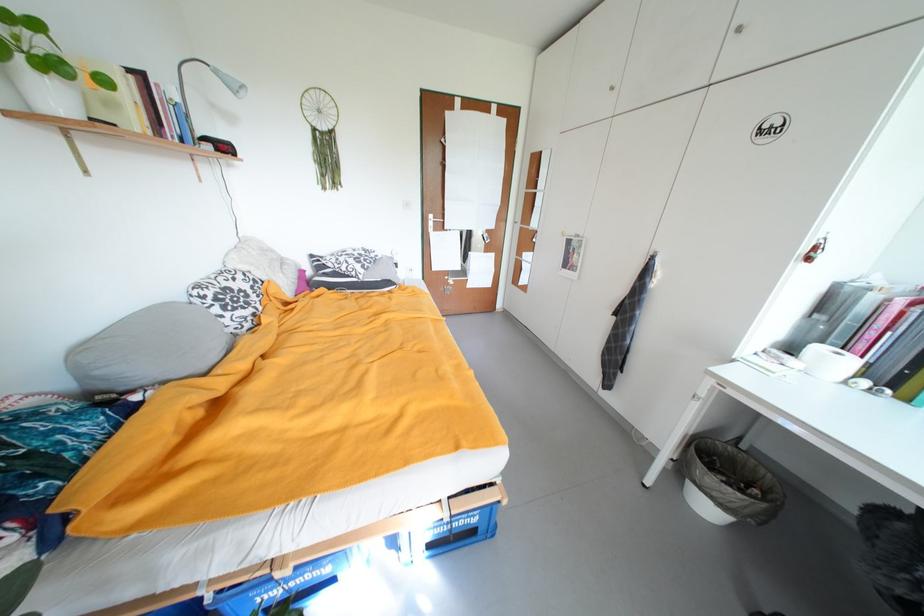
The height and width of the screenshot is (616, 924). In order to click on white potted plant in this screenshot , I will do `click(38, 68)`.